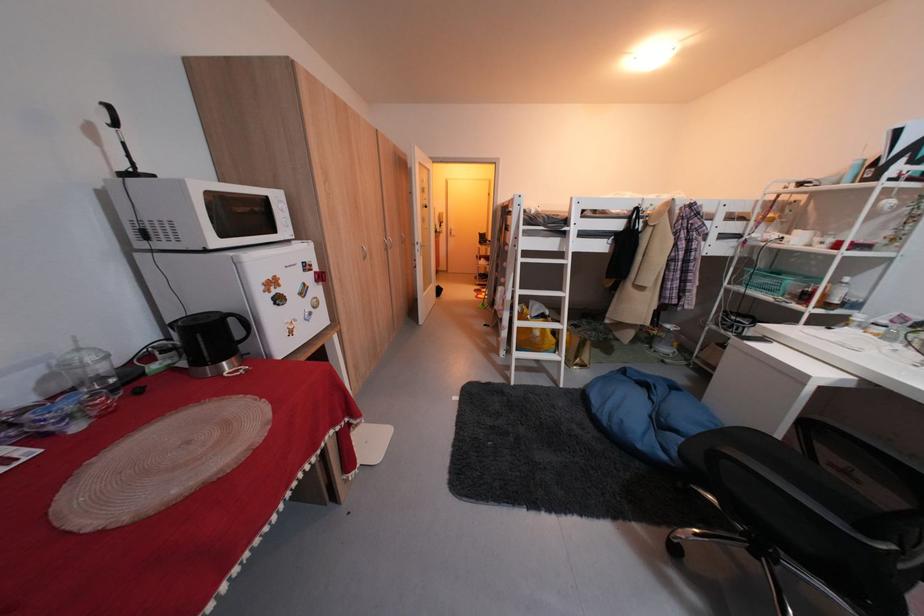
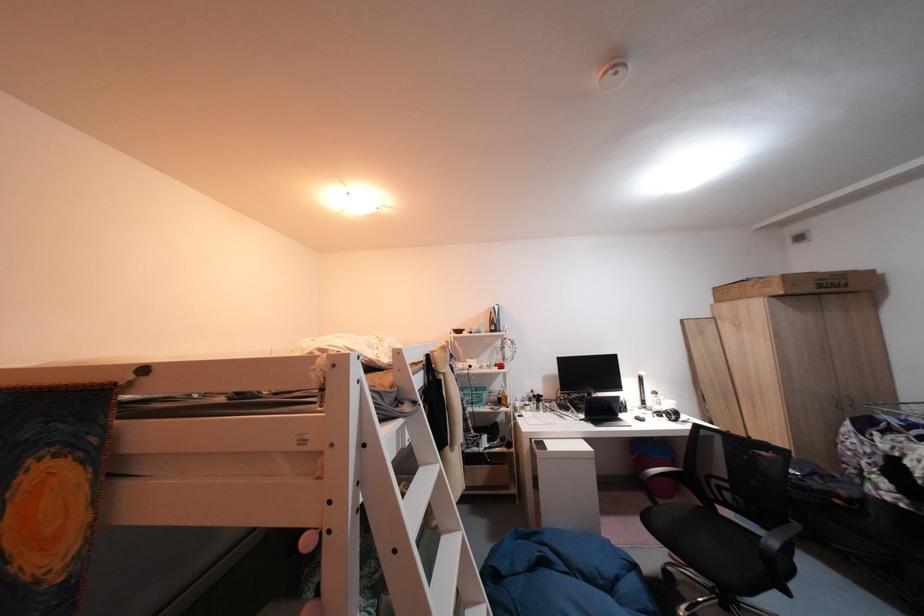
In the second image, find the point that corresponds to the point at 527,240 in the first image.

(370, 485)